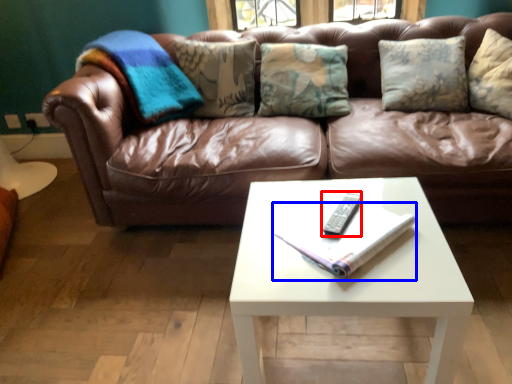
Question: Which object is closer to the camera taking this photo, remote (highlighted by a red box) or book (highlighted by a blue box)?

Choices:
 (A) remote
 (B) book

Answer: (B)